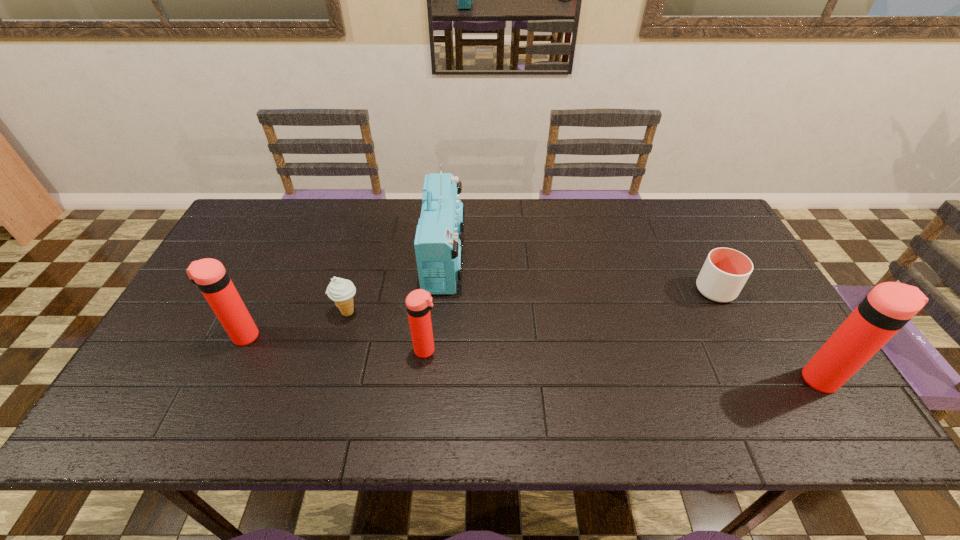
The height and width of the screenshot is (540, 960). In order to click on free location that satisfies the following two spatial constraints: 1. on the front side of the icecream; 2. on the right side of the second thermos bottle from right to left in this screenshot , I will do click(x=337, y=350).

Identify the location of vacant position in the image that satisfies the following two spatial constraints: 1. on the front-facing side of the cup; 2. on the left side of the radio receiver. This screenshot has width=960, height=540. (442, 290).